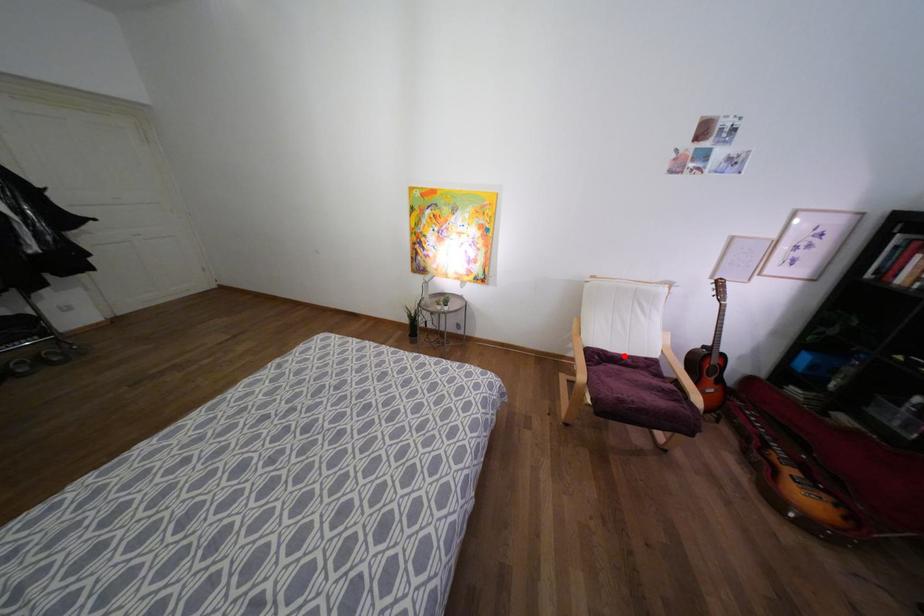
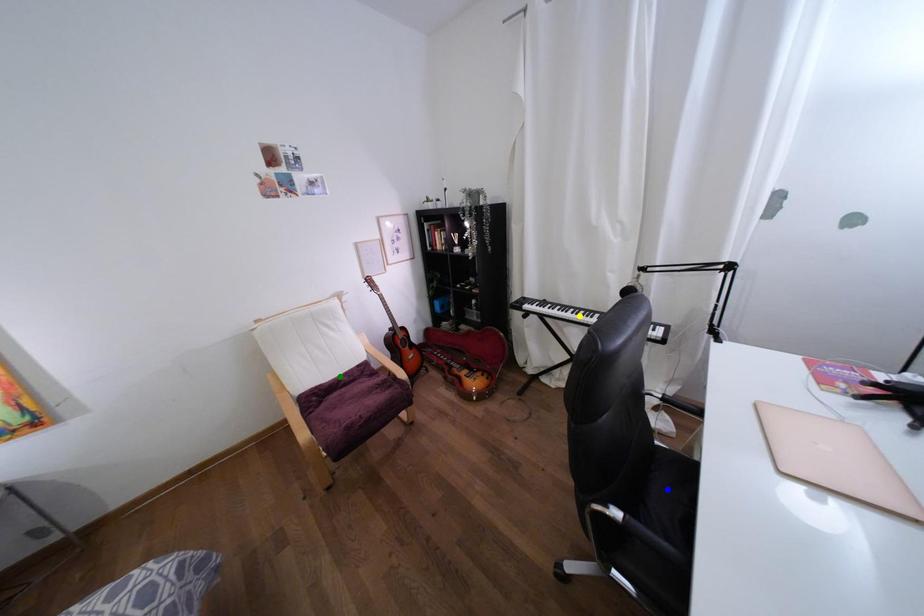
Question: I am providing you with two images of the same scene from different viewpoints. A red point is marked on the first image. You are given multiple points on the second image. Can you choose the point in image 2 that corresponds to the point in image 1?

Choices:
 (A) yellow point
 (B) blue point
 (C) green point

Answer: (C)